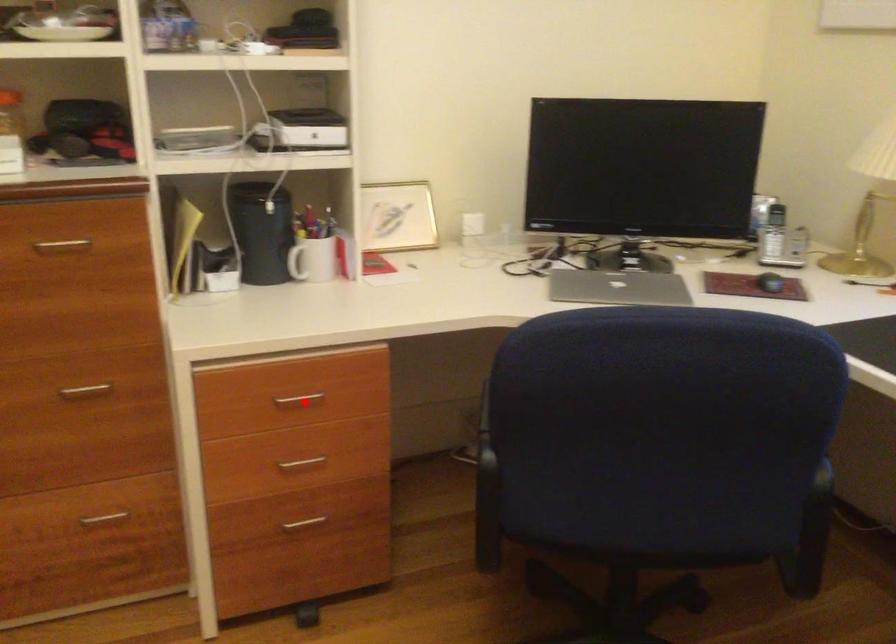
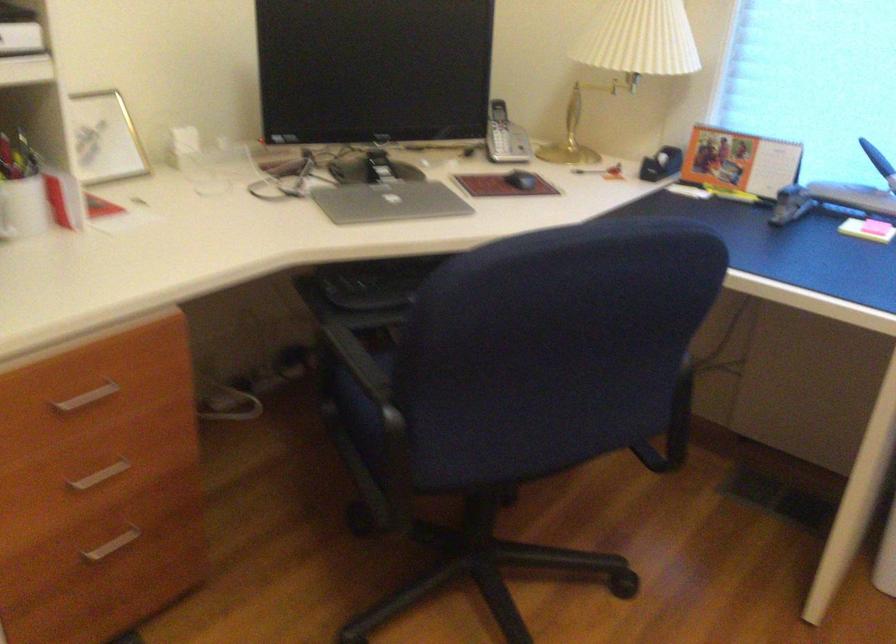
Question: I am providing you with two images of the same scene from different viewpoints. A red point is shown in image1. For the corresponding object point in image2, is it positioned nearer or farther from the camera?

Choices:
 (A) Nearer
 (B) Farther

Answer: (A)